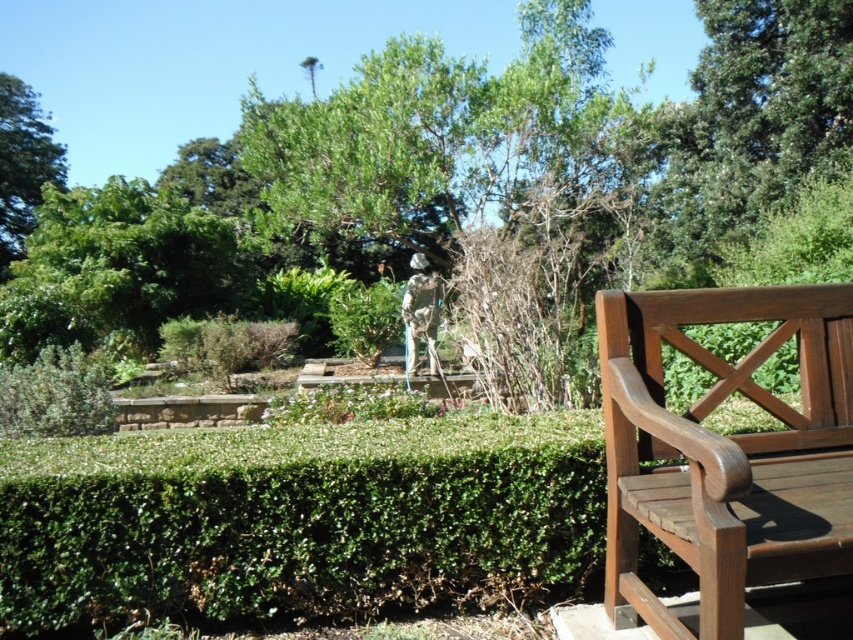
Question: Among these objects, which one is nearest to the camera?

Choices:
 (A) dark brown wood bench at right
 (B) green leafy tree at upper left
 (C) silver metallic statue at center

Answer: (A)

Question: Is dark brown wood bench at right below silver metallic statue at center?

Choices:
 (A) no
 (B) yes

Answer: (B)

Question: Can you confirm if dark brown wood bench at right is smaller than green leafy tree at upper left?

Choices:
 (A) no
 (B) yes

Answer: (A)

Question: Among these objects, which one is nearest to the camera?

Choices:
 (A) green leafy tree at upper left
 (B) green leafy tree at center
 (C) silver metallic statue at center
 (D) dark brown wood bench at right

Answer: (D)

Question: Which point is closer to the camera?

Choices:
 (A) (635, 250)
 (B) (663, 298)
 (C) (1, 93)
 (D) (405, 358)

Answer: (B)

Question: Considering the relative positions of dark brown wood bench at right and silver metallic statue at center in the image provided, where is dark brown wood bench at right located with respect to silver metallic statue at center?

Choices:
 (A) above
 (B) below

Answer: (B)